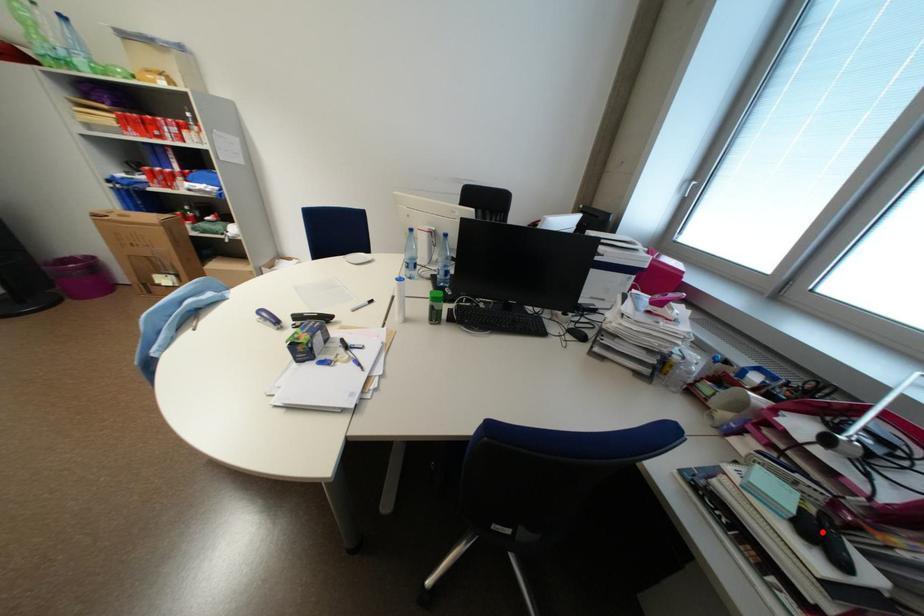
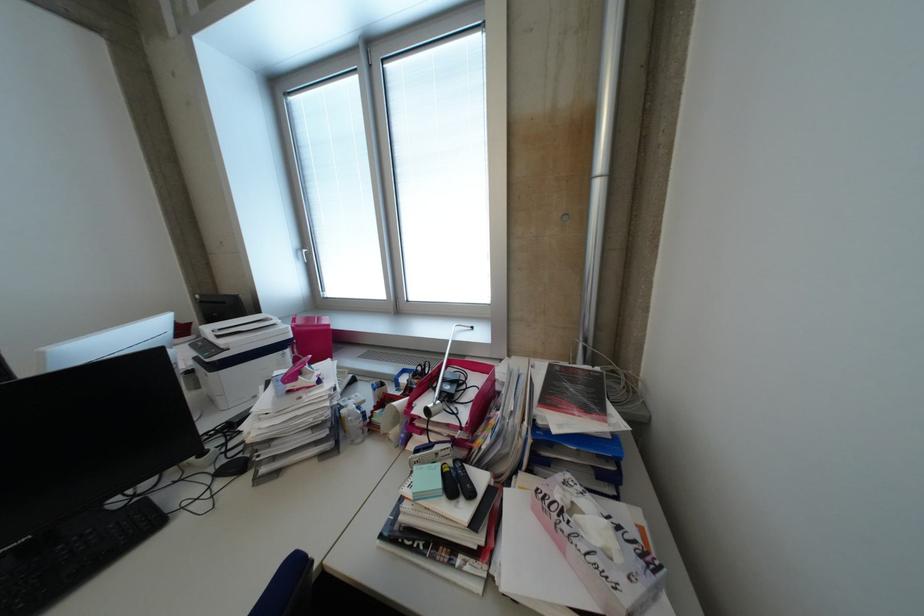
Where in the second image is the point corresponding to the highlighted location from the first image?

(464, 485)